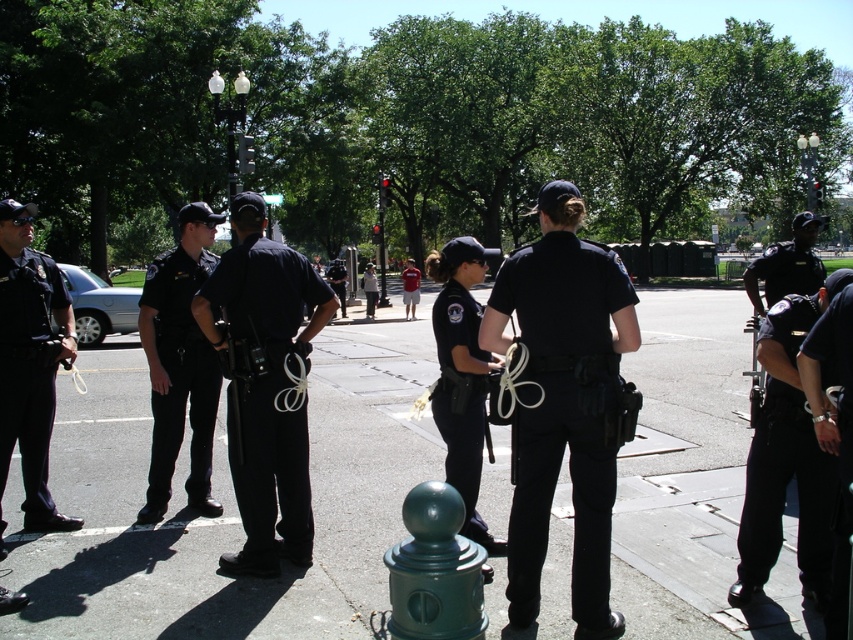
You are a pedestrian walking along the street and want to reach the point marked as point (403,499). There is an obstacle at point (558,275). Will you encounter this obstacle before reaching your destination?

Yes, you will encounter the obstacle at point (558,275) before reaching point (403,499) because point (558,275) is in front of point (403,499).

You are a photographer trying to capture a photo of the black matte uniform at center and the green matte hydrant at lower center. If you want to ensure both objects are fully visible in the frame, which object should you position closer to the edge of the frame to avoid cropping?

The black matte uniform at center might be wider than the green matte hydrant at lower center, so positioning the black matte uniform at center closer to the edge of the frame would allow more space for the potentially narrower green matte hydrant at lower center to fit without cropping.